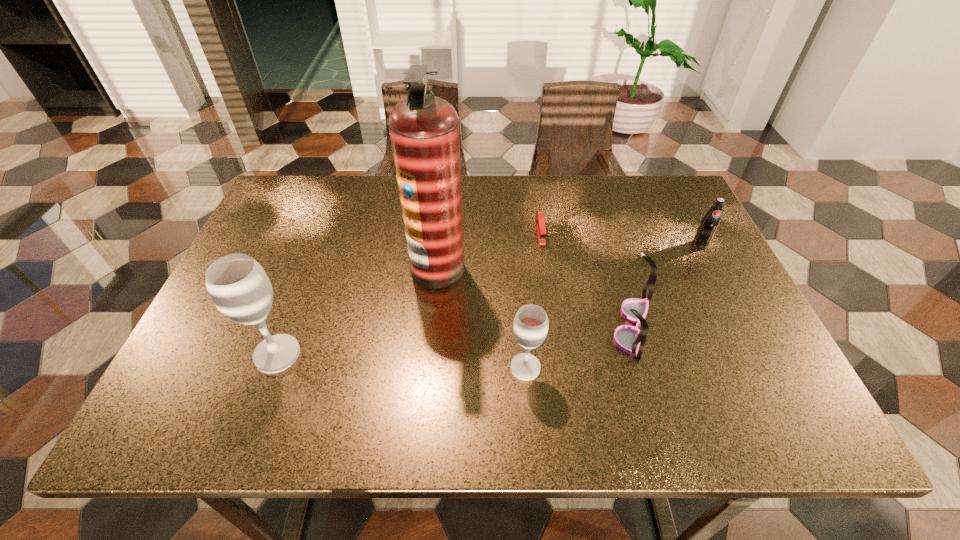
Where is `free space between the fifth object from left to right and the rightmost object`? free space between the fifth object from left to right and the rightmost object is located at coordinates (666, 285).

You are a GUI agent. You are given a task and a screenshot of the screen. Output one action in this format:
    pyautogui.click(x=<x>, y=<y>)
    Task: Click on the free space that is in between the pop and the third object from left to right
    The width and height of the screenshot is (960, 540).
    Given the screenshot: What is the action you would take?
    click(x=612, y=306)

This screenshot has width=960, height=540. What are the coordinates of `free space between the shorter wineglass and the rightmost object` in the screenshot? It's located at pos(612,306).

This screenshot has height=540, width=960. In order to click on free space between the rightmost object and the fire extinguisher in this screenshot , I will do `click(569, 256)`.

The height and width of the screenshot is (540, 960). In order to click on vacant region between the right wineglass and the pop in this screenshot , I will do `click(612, 306)`.

Find the location of a particular element. The height and width of the screenshot is (540, 960). vacant region between the second object from right to left and the third object from left to right is located at coordinates (579, 347).

This screenshot has width=960, height=540. What are the coordinates of `free space between the tallest object and the taller wineglass` in the screenshot? It's located at (357, 311).

The width and height of the screenshot is (960, 540). I want to click on object that stands as the second closest to the shorter wineglass, so click(x=424, y=130).

Locate an element on the screen. Image resolution: width=960 pixels, height=540 pixels. the fifth closest object relative to the shortest object is located at coordinates (239, 287).

In order to click on free location that satisfies the following two spatial constraints: 1. on the back side of the fifth object from left to right; 2. at the nozzle of the fire extinguisher in this screenshot , I will do `click(615, 267)`.